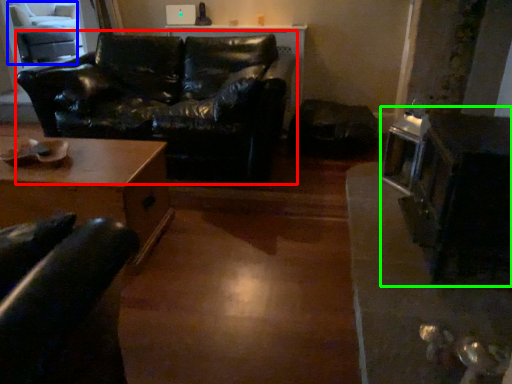
Question: Considering the real-world distances, which object is farthest from studio couch (highlighted by a red box)? swivel chair (highlighted by a blue box) or appliance (highlighted by a green box)?

Choices:
 (A) swivel chair
 (B) appliance

Answer: (A)